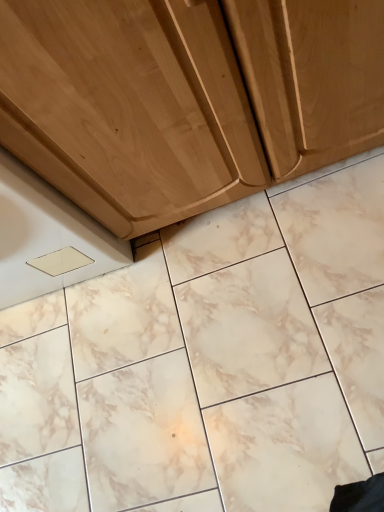
Describe the element at coordinates (186, 98) in the screenshot. I see `wooden cabinet at upper center` at that location.

Measure the distance between point (53, 84) and camera.

The depth of point (53, 84) is 23.66 inches.

Find the location of a particular element. The width and height of the screenshot is (384, 512). wooden cabinet at upper center is located at coordinates (186, 98).

Image resolution: width=384 pixels, height=512 pixels. I want to click on wooden cabinet at upper center, so click(186, 98).